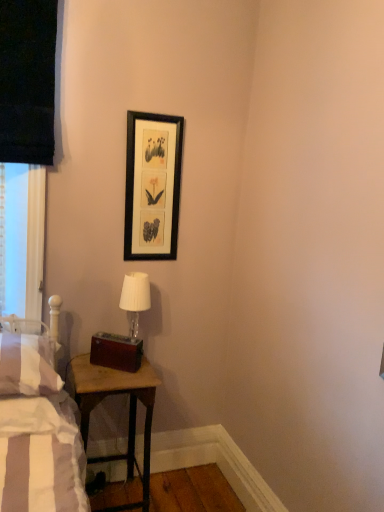
Question: Is white fabric lampshade at center outside of black matte picture frame at upper center?

Choices:
 (A) yes
 (B) no

Answer: (A)

Question: From a real-world perspective, is white fabric lampshade at center below black matte picture frame at upper center?

Choices:
 (A) no
 (B) yes

Answer: (B)

Question: Is white fabric lampshade at center shorter than black matte picture frame at upper center?

Choices:
 (A) no
 (B) yes

Answer: (B)

Question: Considering the relative positions of white fabric lampshade at center and black matte picture frame at upper center in the image provided, is white fabric lampshade at center in front of black matte picture frame at upper center?

Choices:
 (A) yes
 (B) no

Answer: (A)

Question: Can you see white fabric lampshade at center touching black matte picture frame at upper center?

Choices:
 (A) no
 (B) yes

Answer: (A)

Question: Is white fabric lampshade at center surrounding black matte picture frame at upper center?

Choices:
 (A) no
 (B) yes

Answer: (A)

Question: From the image's perspective, is wooden table at lower left over white striped pillow at left?

Choices:
 (A) yes
 (B) no

Answer: (B)

Question: Is the depth of wooden table at lower left greater than that of white striped pillow at left?

Choices:
 (A) yes
 (B) no

Answer: (A)

Question: Is wooden table at lower left positioned beyond the bounds of white striped pillow at left?

Choices:
 (A) no
 (B) yes

Answer: (B)

Question: From a real-world perspective, is wooden table at lower left under white striped pillow at left?

Choices:
 (A) yes
 (B) no

Answer: (A)

Question: Is white striped pillow at left at the back of wooden table at lower left?

Choices:
 (A) no
 (B) yes

Answer: (A)

Question: From the image's perspective, would you say wooden table at lower left is shown under white striped pillow at left?

Choices:
 (A) yes
 (B) no

Answer: (A)

Question: Does black matte picture frame at upper center come behind white striped pillow at left?

Choices:
 (A) yes
 (B) no

Answer: (A)